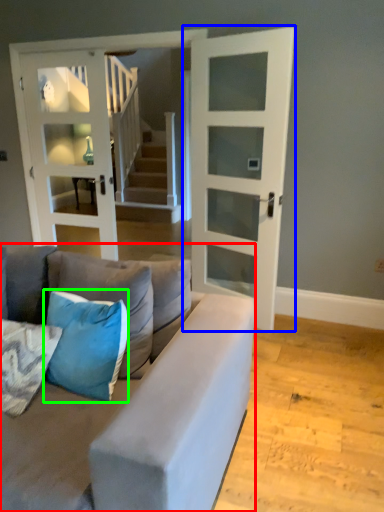
Question: Which is farther away from studio couch (highlighted by a red box)? door (highlighted by a blue box) or pillow (highlighted by a green box)?

Choices:
 (A) door
 (B) pillow

Answer: (A)